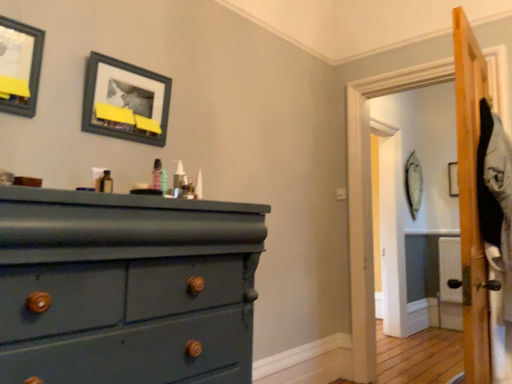
Question: Are teal matte wood dresser at left and matte black picture frame at upper center, the 2th picture frame when ordered from right to left, located far from each other?

Choices:
 (A) no
 (B) yes

Answer: (A)

Question: From the image's perspective, would you say teal matte wood dresser at left is shown under matte black picture frame at upper center, acting as the second picture frame starting from the back?

Choices:
 (A) yes
 (B) no

Answer: (A)

Question: Is teal matte wood dresser at left at the left side of matte black picture frame at upper center, the second picture frame positioned from the front?

Choices:
 (A) no
 (B) yes

Answer: (A)

Question: Considering the relative positions of teal matte wood dresser at left and matte black picture frame at upper center, the second picture frame positioned from the front, in the image provided, is teal matte wood dresser at left to the right of matte black picture frame at upper center, the second picture frame positioned from the front, from the viewer's perspective?

Choices:
 (A) no
 (B) yes

Answer: (B)

Question: Can you confirm if teal matte wood dresser at left is wider than matte black picture frame at upper center, which ranks as the 2th picture frame in left-to-right order?

Choices:
 (A) yes
 (B) no

Answer: (A)

Question: Considering the relative sizes of teal matte wood dresser at left and matte black picture frame at upper center, the second picture frame positioned from the front, in the image provided, is teal matte wood dresser at left shorter than matte black picture frame at upper center, the second picture frame positioned from the front,?

Choices:
 (A) no
 (B) yes

Answer: (A)

Question: Considering the relative sizes of translucent plastic pump at center, acting as the first toiletry starting from the right, and matte black picture frame at upper left, the first picture frame in the front-to-back sequence, in the image provided, is translucent plastic pump at center, acting as the first toiletry starting from the right, thinner than matte black picture frame at upper left, the first picture frame in the front-to-back sequence,?

Choices:
 (A) no
 (B) yes

Answer: (B)

Question: Is translucent plastic pump at center, acting as the second toiletry starting from the left, outside matte black picture frame at upper left, the 3th picture frame positioned from the back?

Choices:
 (A) yes
 (B) no

Answer: (A)

Question: From the image's perspective, is translucent plastic pump at center, acting as the first toiletry starting from the right, beneath matte black picture frame at upper left, the first picture frame positioned from the left?

Choices:
 (A) no
 (B) yes

Answer: (B)

Question: From a real-world perspective, is translucent plastic pump at center, acting as the second toiletry starting from the left, beneath matte black picture frame at upper left, which appears as the third picture frame when viewed from the right?

Choices:
 (A) yes
 (B) no

Answer: (A)

Question: From a real-world perspective, is translucent plastic pump at center, acting as the first toiletry starting from the right, positioned over matte black picture frame at upper left, the 3th picture frame positioned from the back, based on gravity?

Choices:
 (A) yes
 (B) no

Answer: (B)

Question: Is matte black picture frame at upper left, the 3th picture frame positioned from the back, at the back of translucent plastic pump at center, acting as the first toiletry starting from the right?

Choices:
 (A) yes
 (B) no

Answer: (B)

Question: From a real-world perspective, is matte black picture frame at upper left, the first picture frame in the front-to-back sequence, located higher than matte black picture frame at upper center, the 2th picture frame when ordered from right to left?

Choices:
 (A) yes
 (B) no

Answer: (A)